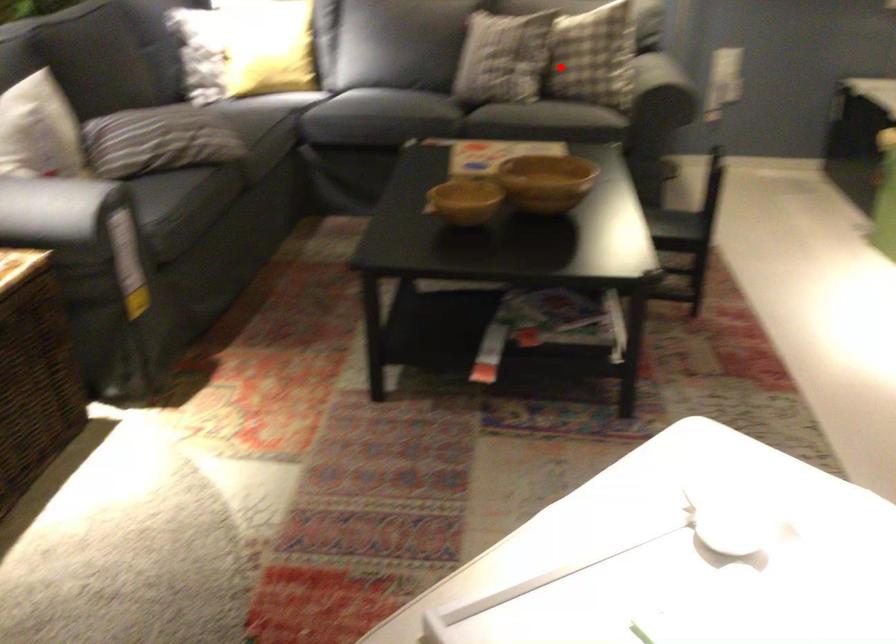
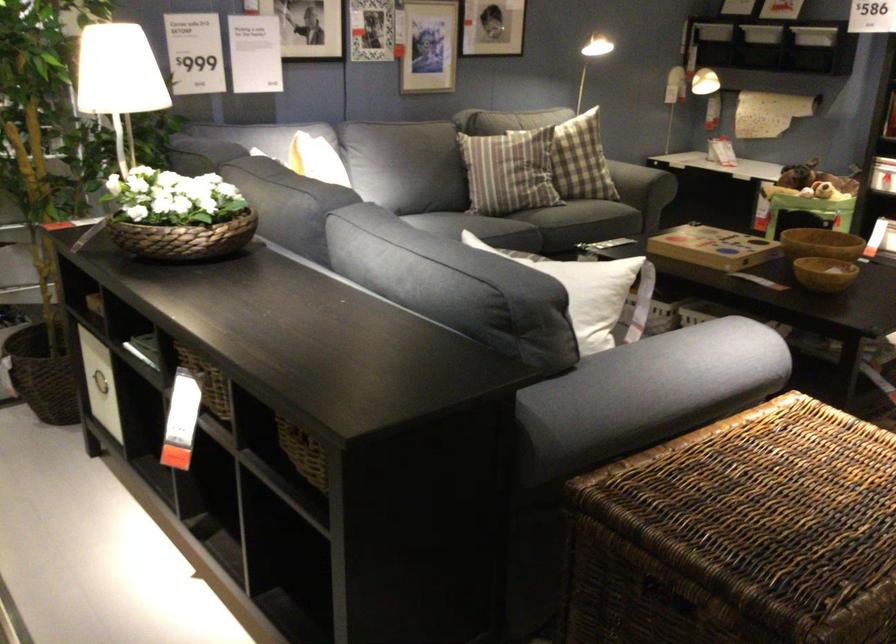
Question: I am providing you with two images of the same scene from different viewpoints. Image1 has a red point marked. In image2, the corresponding 3D location appears at what relative position? Reply with the corresponding letter.

Choices:
 (A) Closer
 (B) Farther

Answer: (B)